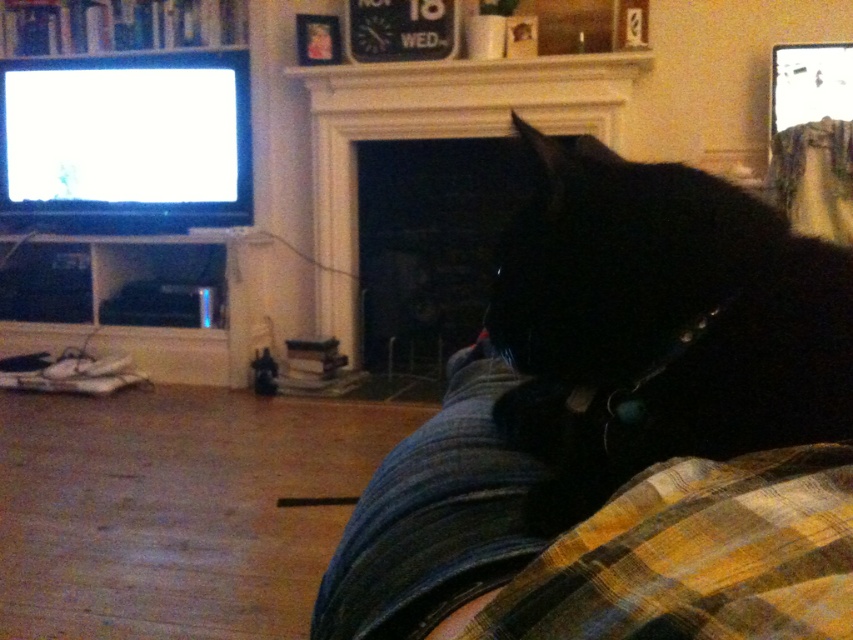
Between black fur cat at lower right and plaid fabric at lower right, which one appears on the right side from the viewer's perspective?

From the viewer's perspective, black fur cat at lower right appears more on the right side.

Who is higher up, black fur cat at lower right or plaid fabric at lower right?

black fur cat at lower right is above.

Does point (648, 449) come farther from viewer compared to point (692, 512)?

Yes, it is.

The image size is (853, 640). Identify the location of black fur cat at lower right. (662, 321).

Between black fur cat at lower right and white stone fireplace at center, which one has more height?

white stone fireplace at center

From the picture: Is black fur cat at lower right taller than white stone fireplace at center?

In fact, black fur cat at lower right may be shorter than white stone fireplace at center.

Find the location of `black fur cat at lower right`. black fur cat at lower right is located at coordinates (662, 321).

Identify the location of black fur cat at lower right. The image size is (853, 640). (662, 321).

Does point (636, 612) come farther from viewer compared to point (576, 61)?

No, (636, 612) is in front of (576, 61).

Who is more distant from viewer, (718,529) or (448,67)?

The point (448,67) is more distant.

This screenshot has height=640, width=853. I want to click on plaid fabric at lower right, so click(697, 556).